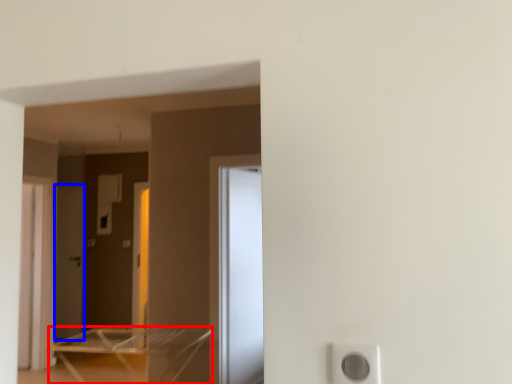
Question: Among these objects, which one is nearest to the camera, furniture (highlighted by a red box) or screen door (highlighted by a blue box)?

Choices:
 (A) furniture
 (B) screen door

Answer: (A)